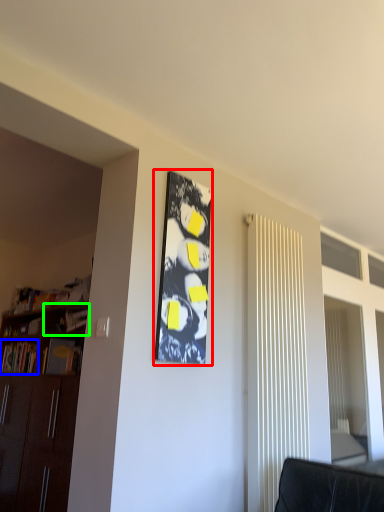
Question: Considering the real-world distances, which object is closest to bulletin board (highlighted by a red box)? book (highlighted by a blue box) or shelf (highlighted by a green box).

Choices:
 (A) book
 (B) shelf

Answer: (B)